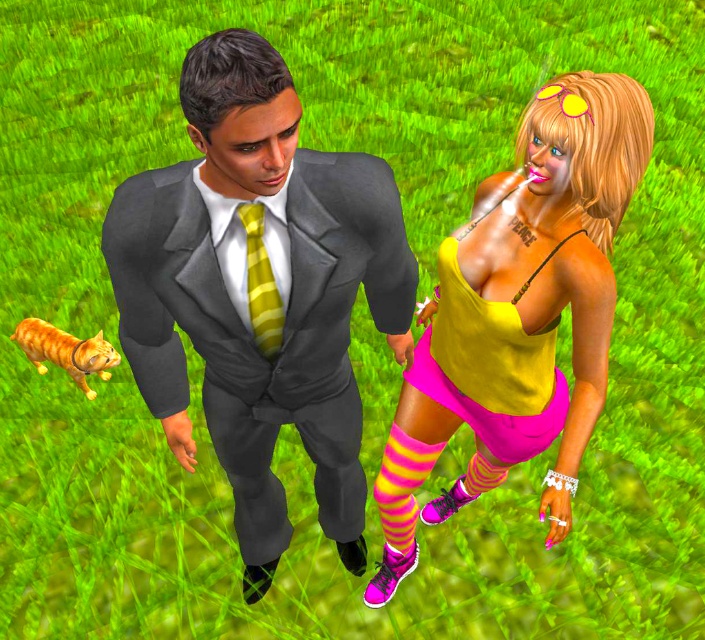
Question: Is matte gray suit at center to the left of yellow striped tie at center from the viewer's perspective?

Choices:
 (A) yes
 (B) no

Answer: (A)

Question: Where is matte yellow tank top at center located in relation to yellow striped tie at center in the image?

Choices:
 (A) right
 (B) left

Answer: (A)

Question: Can you confirm if matte yellow tank top at center is positioned to the right of yellow striped tie at center?

Choices:
 (A) no
 (B) yes

Answer: (B)

Question: Among these objects, which one is nearest to the camera?

Choices:
 (A) matte yellow tank top at center
 (B) pink/yellow striped sock at lower center

Answer: (A)

Question: Estimate the real-world distances between objects in this image. Which object is closer to the matte gray suit at center?

Choices:
 (A) pink/yellow striped sock at lower center
 (B) yellow matte tank top at center

Answer: (B)

Question: Among these objects, which one is nearest to the camera?

Choices:
 (A) yellow striped tie at center
 (B) matte yellow tank top at center

Answer: (A)